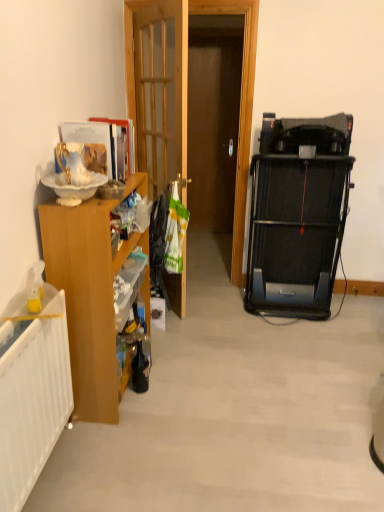
Question: Should I look upward or downward to see wooden at left?

Choices:
 (A) up
 (B) down

Answer: (A)

Question: Does wooden at left appear on the right side of wooden cabinet at left?

Choices:
 (A) no
 (B) yes

Answer: (B)

Question: From a real-world perspective, is wooden at left located beneath wooden cabinet at left?

Choices:
 (A) no
 (B) yes

Answer: (A)

Question: Is wooden at left closer to the viewer compared to wooden cabinet at left?

Choices:
 (A) yes
 (B) no

Answer: (B)

Question: Is wooden at left wider than wooden cabinet at left?

Choices:
 (A) no
 (B) yes

Answer: (A)

Question: Is wooden at left bigger than wooden cabinet at left?

Choices:
 (A) no
 (B) yes

Answer: (A)

Question: Considering the relative sizes of wooden at left and wooden cabinet at left in the image provided, is wooden at left shorter than wooden cabinet at left?

Choices:
 (A) no
 (B) yes

Answer: (A)

Question: Is wooden cabinet at left positioned beyond the bounds of wooden at left?

Choices:
 (A) no
 (B) yes

Answer: (B)

Question: Is wooden cabinet at left smaller than wooden at left?

Choices:
 (A) yes
 (B) no

Answer: (B)

Question: Considering the relative sizes of wooden cabinet at left and wooden at left in the image provided, is wooden cabinet at left wider than wooden at left?

Choices:
 (A) yes
 (B) no

Answer: (A)

Question: Is wooden cabinet at left not close to wooden at left?

Choices:
 (A) no
 (B) yes

Answer: (B)

Question: Is wooden cabinet at left at the right side of wooden at left?

Choices:
 (A) yes
 (B) no

Answer: (B)

Question: Can you confirm if wooden cabinet at left is shorter than wooden at left?

Choices:
 (A) no
 (B) yes

Answer: (B)

Question: In terms of size, does wooden cabinet at left appear bigger or smaller than wooden at left?

Choices:
 (A) small
 (B) big

Answer: (B)